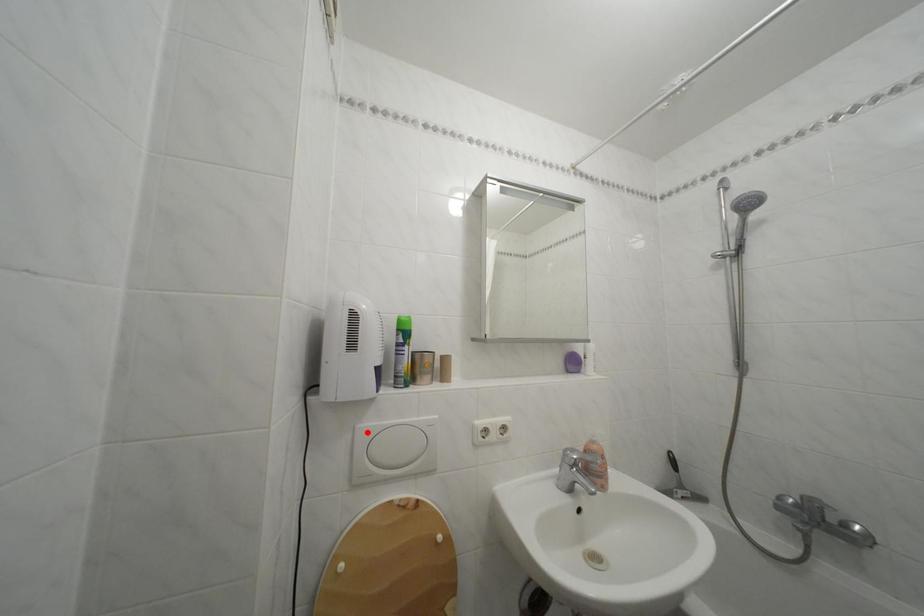
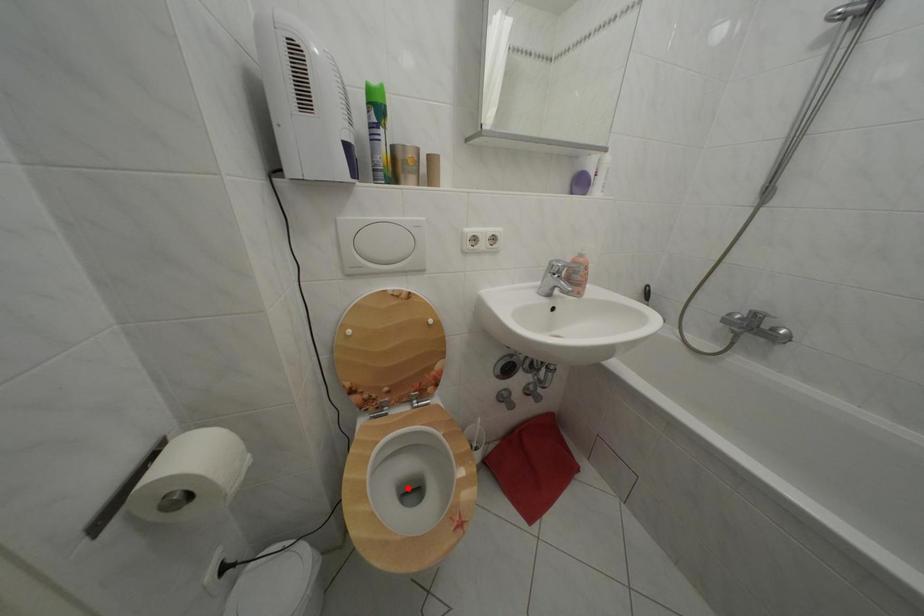
I am providing you with two images of the same scene from different viewpoints. A red point is marked on the first image and another point is marked on the second image. Does the point marked in image1 correspond to the same location as the one in image2?

No